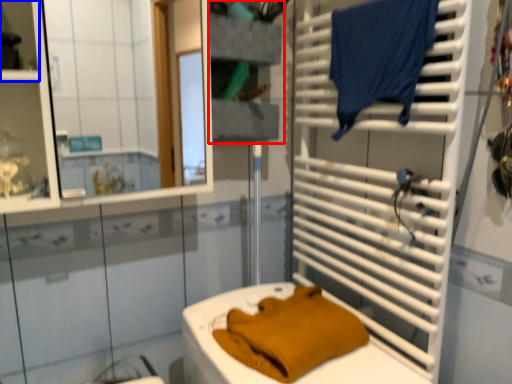
Question: Which object is closer to the camera taking this photo, shelf (highlighted by a red box) or shelf (highlighted by a blue box)?

Choices:
 (A) shelf
 (B) shelf

Answer: (B)